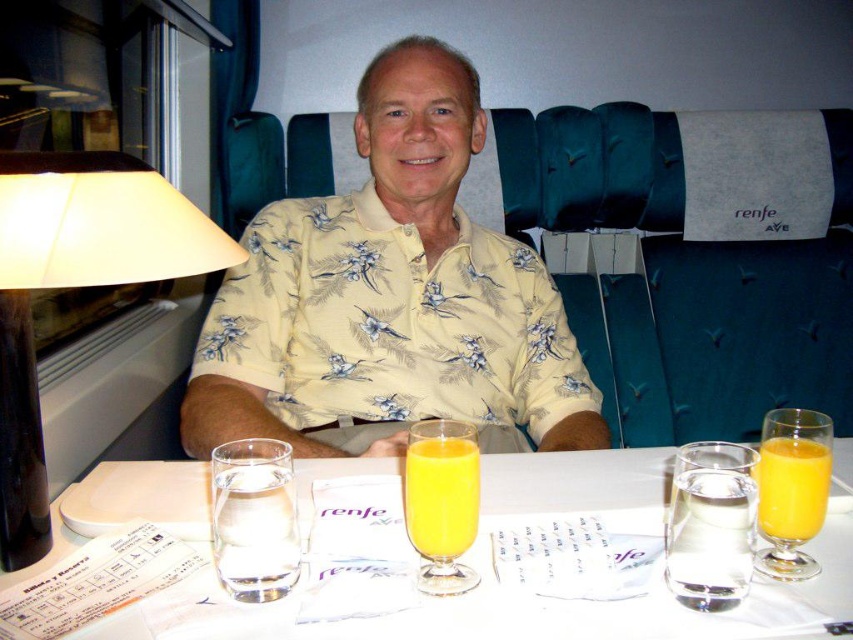
Can you confirm if yellow floral shirt at center is wider than orange liquid at table right?

Correct, the width of yellow floral shirt at center exceeds that of orange liquid at table right.

Based on the photo, is yellow floral shirt at center further to camera compared to orange liquid at table right?

Yes.

What do you see at coordinates (389, 296) in the screenshot? I see `yellow floral shirt at center` at bounding box center [389, 296].

The width and height of the screenshot is (853, 640). In order to click on yellow floral shirt at center in this screenshot , I will do 389,296.

Who is taller, clear glass water at table right or orange liquid at table right?

Standing taller between the two is clear glass water at table right.

Who is higher up, clear glass water at table right or orange liquid at table right?

orange liquid at table right is above.

Between point (668, 580) and point (757, 474), which one is positioned behind?

The point (668, 580) is more distant.

Where is `clear glass water at table right`? Image resolution: width=853 pixels, height=640 pixels. clear glass water at table right is located at coordinates (711, 524).

Is clear glass water at center wider than orange liquid at table right?

Indeed, clear glass water at center has a greater width compared to orange liquid at table right.

Who is lower down, clear glass water at center or orange liquid at table right?

clear glass water at center is below.

Is point (62, 499) farther from viewer compared to point (804, 506)?

Yes, it is.

Where is `clear glass water at center`? Image resolution: width=853 pixels, height=640 pixels. clear glass water at center is located at coordinates (576, 484).